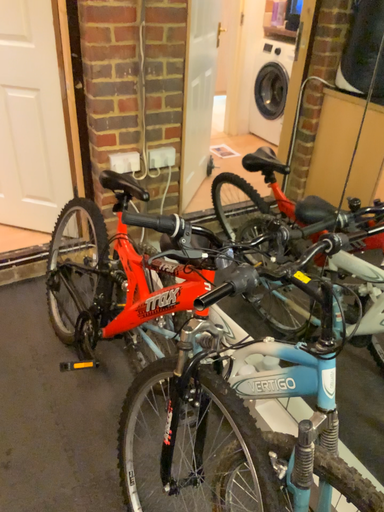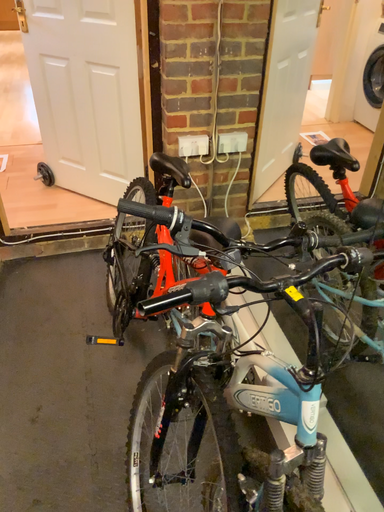
Question: How did the camera likely rotate when shooting the video?

Choices:
 (A) rotated right
 (B) rotated left

Answer: (B)